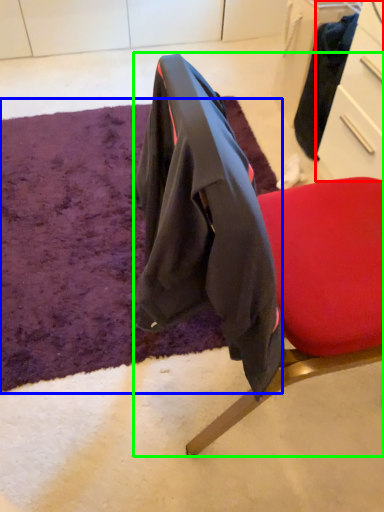
Question: Estimate the real-world distances between objects in this image. Which object is closer to drawer (highlighted by a red box), mat (highlighted by a blue box) or chair (highlighted by a green box)?

Choices:
 (A) mat
 (B) chair

Answer: (B)